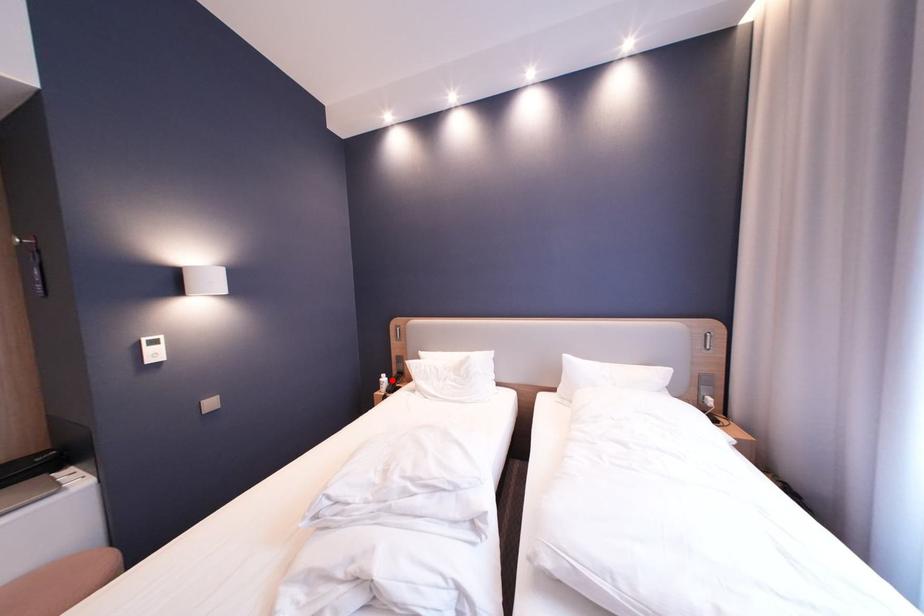
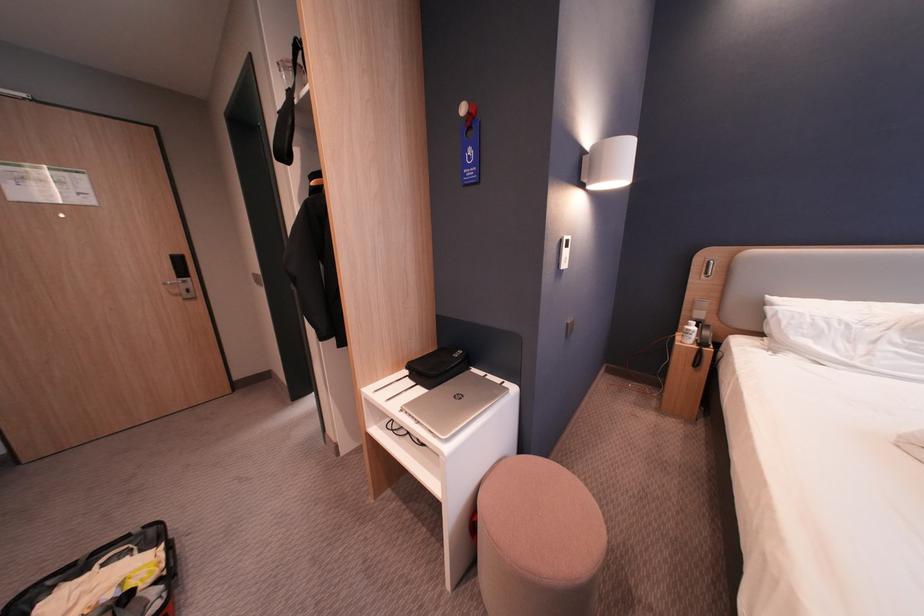
The point at the highlighted location is marked in the first image. Where is the corresponding point in the second image?

(698, 328)